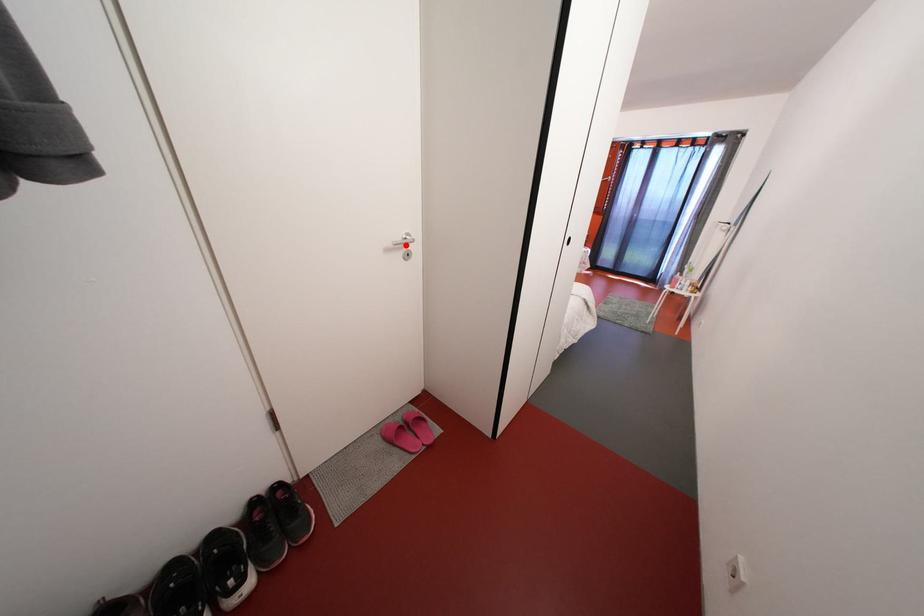
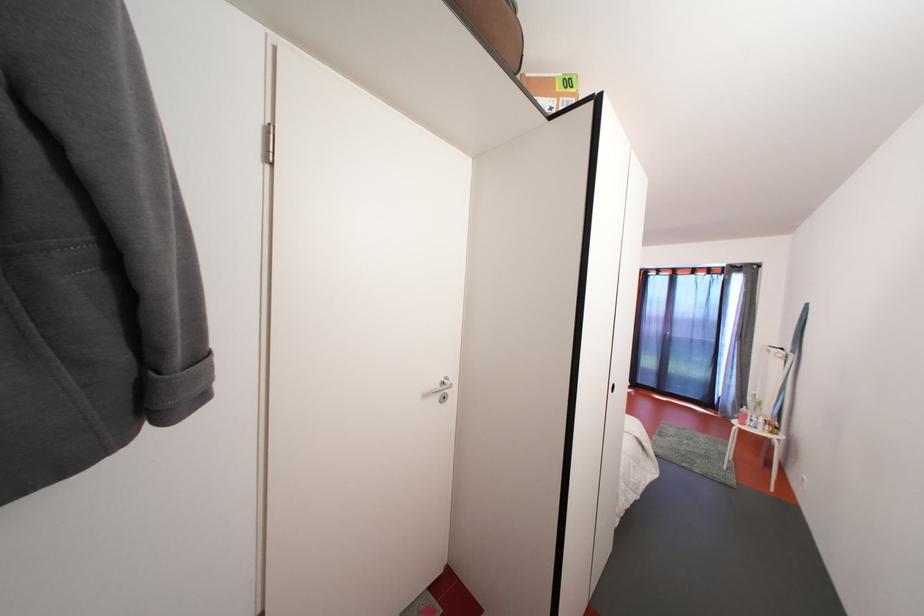
Locate, in the second image, the point that corresponds to the highlighted location in the first image.

(444, 391)